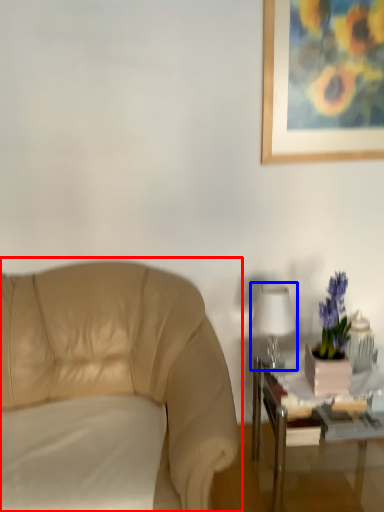
Question: Which of the following is the closest to the observer, chair (highlighted by a red box) or table lamp (highlighted by a blue box)?

Choices:
 (A) chair
 (B) table lamp

Answer: (A)